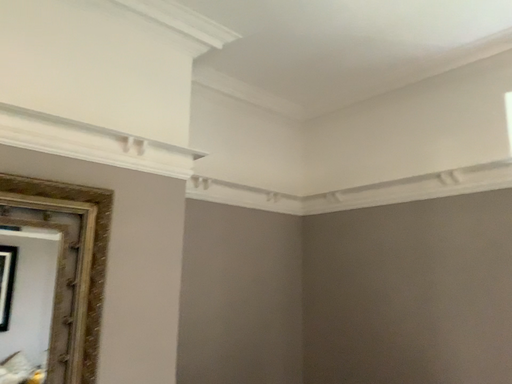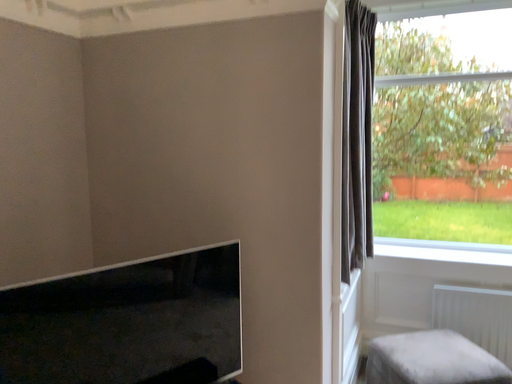
Question: Which way did the camera rotate in the video?

Choices:
 (A) rotated upward
 (B) rotated downward

Answer: (B)